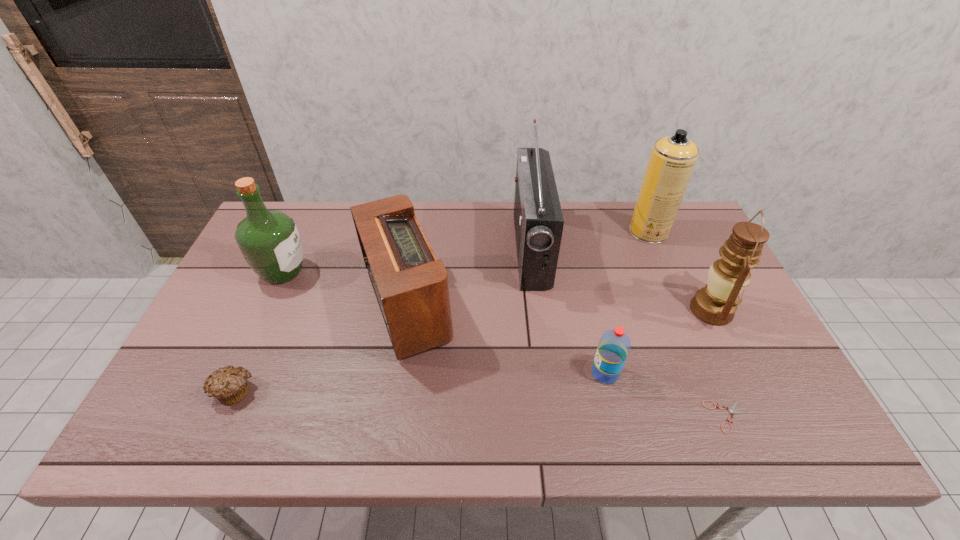
This screenshot has width=960, height=540. What are the coordinates of `vacant space located 0.380m on the front label of the fifth object from left to right` in the screenshot? It's located at (x=433, y=373).

Locate an element on the screen. The width and height of the screenshot is (960, 540). blank space located on the right of the muffin is located at coordinates (379, 392).

Find the location of `vacant position located 0.150m on the left of the shears`. vacant position located 0.150m on the left of the shears is located at coordinates (639, 417).

Identify the location of radio receiver situated at the far edge. The width and height of the screenshot is (960, 540). (538, 220).

I want to click on aerosol can present at the far edge, so click(672, 160).

The width and height of the screenshot is (960, 540). What are the coordinates of `object that is at the near edge` in the screenshot? It's located at click(731, 410).

The width and height of the screenshot is (960, 540). Identify the location of liquor situated at the left edge. (269, 240).

Identify the location of muffin located at the left edge. (229, 385).

The width and height of the screenshot is (960, 540). In order to click on aerosol can that is at the right edge in this screenshot , I will do `click(672, 160)`.

Locate an element on the screen. The width and height of the screenshot is (960, 540). oil lamp present at the right edge is located at coordinates (716, 303).